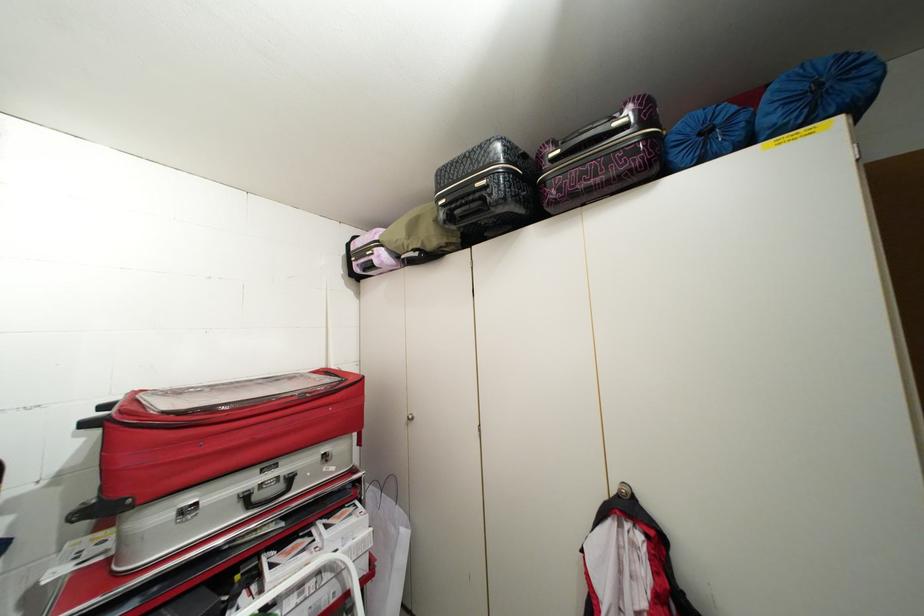
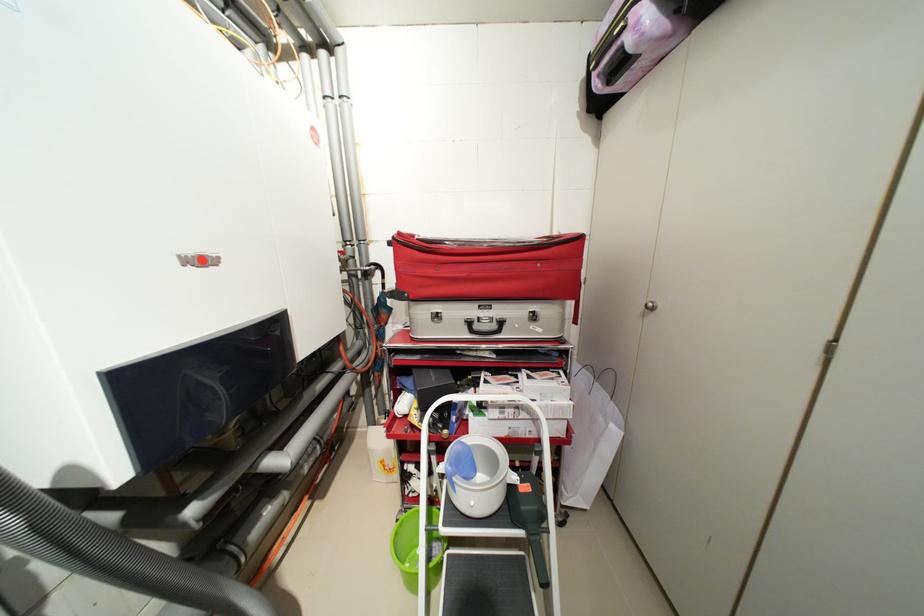
Find the pixel in the second image that matches the point at 287,487 in the first image.

(502, 326)